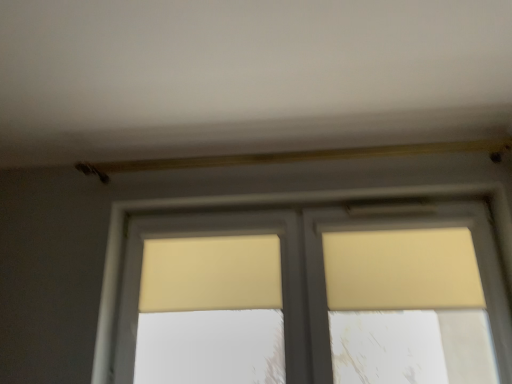
Question: Can you confirm if beige fabric curtain at upper right, which is counted as the first curtain, starting from the right, is taller than beige fabric curtain at center, the 2th curtain positioned from the right?

Choices:
 (A) no
 (B) yes

Answer: (B)

Question: Is beige fabric curtain at upper right, which is counted as the first curtain, starting from the right, not inside beige fabric curtain at center, arranged as the 1th curtain when viewed from the left?

Choices:
 (A) no
 (B) yes

Answer: (B)

Question: Is beige fabric curtain at center, the 2th curtain positioned from the right, inside beige fabric curtain at upper right, the 2th curtain from the left?

Choices:
 (A) yes
 (B) no

Answer: (B)

Question: Considering the relative positions of beige fabric curtain at upper right, which is counted as the first curtain, starting from the right, and beige fabric curtain at center, arranged as the 1th curtain when viewed from the left, in the image provided, is beige fabric curtain at upper right, which is counted as the first curtain, starting from the right, to the right of beige fabric curtain at center, arranged as the 1th curtain when viewed from the left, from the viewer's perspective?

Choices:
 (A) yes
 (B) no

Answer: (A)

Question: Does beige fabric curtain at upper right, the 2th curtain from the left, have a smaller size compared to beige fabric curtain at center, arranged as the 1th curtain when viewed from the left?

Choices:
 (A) yes
 (B) no

Answer: (B)

Question: Considering their positions, is beige fabric curtain at center, the 2th curtain positioned from the right, located in front of or behind beige fabric curtain at upper right, the 2th curtain from the left?

Choices:
 (A) front
 (B) behind

Answer: (B)

Question: Is beige fabric curtain at center, arranged as the 1th curtain when viewed from the left, to the left or to the right of beige fabric curtain at upper right, which is counted as the first curtain, starting from the right, in the image?

Choices:
 (A) right
 (B) left

Answer: (B)

Question: Is beige fabric curtain at center, arranged as the 1th curtain when viewed from the left, taller or shorter than beige fabric curtain at upper right, which is counted as the first curtain, starting from the right?

Choices:
 (A) short
 (B) tall

Answer: (A)

Question: From the image's perspective, is beige fabric curtain at center, arranged as the 1th curtain when viewed from the left, located above or below beige fabric curtain at upper right, the 2th curtain from the left?

Choices:
 (A) above
 (B) below

Answer: (B)

Question: Based on their positions, is beige fabric curtain at upper right, the 2th curtain from the left, located to the left or right of matte yellow window at center?

Choices:
 (A) left
 (B) right

Answer: (B)

Question: Considering the positions of beige fabric curtain at upper right, which is counted as the first curtain, starting from the right, and matte yellow window at center in the image, is beige fabric curtain at upper right, which is counted as the first curtain, starting from the right, wider or thinner than matte yellow window at center?

Choices:
 (A) thin
 (B) wide

Answer: (A)

Question: From a real-world perspective, is beige fabric curtain at upper right, which is counted as the first curtain, starting from the right, above or below matte yellow window at center?

Choices:
 (A) below
 (B) above

Answer: (B)

Question: Is beige fabric curtain at upper right, which is counted as the first curtain, starting from the right, situated inside matte yellow window at center or outside?

Choices:
 (A) outside
 (B) inside

Answer: (B)

Question: Based on their sizes in the image, would you say matte yellow window at center is bigger or smaller than beige fabric curtain at upper right, the 2th curtain from the left?

Choices:
 (A) small
 (B) big

Answer: (B)

Question: In terms of height, does matte yellow window at center look taller or shorter compared to beige fabric curtain at upper right, the 2th curtain from the left?

Choices:
 (A) tall
 (B) short

Answer: (A)